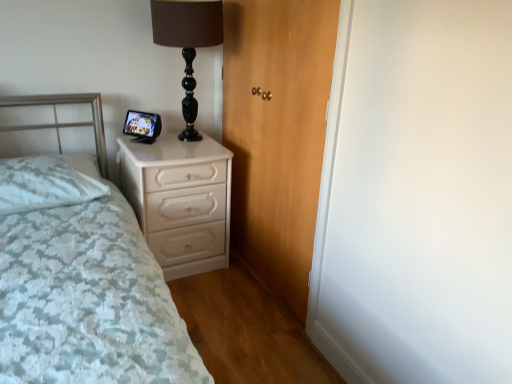
This screenshot has height=384, width=512. What do you see at coordinates (188, 43) in the screenshot?
I see `black glass table lamp at upper center` at bounding box center [188, 43].

What is the approximate height of white textured pillow at left?

white textured pillow at left is 6.54 inches tall.

Where is `white textured bed at left`? This screenshot has width=512, height=384. white textured bed at left is located at coordinates (81, 274).

Where is `white glossy chest of drawers at center`? This screenshot has height=384, width=512. white glossy chest of drawers at center is located at coordinates pyautogui.click(x=180, y=200).

The width and height of the screenshot is (512, 384). I want to click on black glass table lamp at upper center, so click(188, 43).

Is black glass table lamp at upper center next to wooden door at center?

There is a gap between black glass table lamp at upper center and wooden door at center.

Does black glass table lamp at upper center have a greater height compared to wooden door at center?

In fact, black glass table lamp at upper center may be shorter than wooden door at center.

Can you tell me how much white textured pillow at left and white textured bed at left differ in facing direction?

0.811 degrees separate the facing orientations of white textured pillow at left and white textured bed at left.

Considering the relative positions of white textured pillow at left and white textured bed at left in the image provided, is white textured pillow at left to the left or to the right of white textured bed at left?

Clearly, white textured pillow at left is on the left of white textured bed at left in the image.

You are a GUI agent. You are given a task and a screenshot of the screen. Output one action in this format:
    pyautogui.click(x=<x>, y=<y>)
    Task: Click on the pillow behind the white textured bed at left
    The image size is (512, 384).
    Given the screenshot: What is the action you would take?
    pyautogui.click(x=49, y=182)

Considering their positions, is white textured pillow at left located in front of or behind white textured bed at left?

white textured pillow at left is positioned farther from the viewer than white textured bed at left.

Is white glossy chest of drawers at center not inside wooden door at center?

Indeed, white glossy chest of drawers at center is completely outside wooden door at center.

Considering the relative sizes of white glossy chest of drawers at center and wooden door at center in the image provided, is white glossy chest of drawers at center thinner than wooden door at center?

In fact, white glossy chest of drawers at center might be wider than wooden door at center.

Is white glossy chest of drawers at center looking in the opposite direction of wooden door at center?

white glossy chest of drawers at center does not have its back to wooden door at center.

Which is more to the right, white glossy chest of drawers at center or wooden door at center?

wooden door at center.

Is white textured bed at left situated inside white textured pillow at left or outside?

white textured bed at left is spatially situated outside white textured pillow at left.

Between white textured bed at left and white textured pillow at left, which one appears on the left side from the viewer's perspective?

white textured pillow at left is more to the left.

Can you tell me how much white textured bed at left and white textured pillow at left differ in facing direction?

The angular difference between white textured bed at left and white textured pillow at left is 0.811 degrees.

Relative to white textured pillow at left, is white textured bed at left in front or behind?

Visually, white textured bed at left is located in front of white textured pillow at left.

Would you say white textured pillow at left contains white glossy chest of drawers at center?

No, white glossy chest of drawers at center is not inside white textured pillow at left.

Would you say white textured pillow at left is a long distance from white glossy chest of drawers at center?

No, there isn't a large distance between white textured pillow at left and white glossy chest of drawers at center.

Is point (38, 203) closer or farther from the camera than point (226, 243)?

Point (38, 203) is closer to the camera than point (226, 243).

The height and width of the screenshot is (384, 512). Identify the location of table lamp behind the white textured pillow at left. (188, 43).

From a real-world perspective, is white textured pillow at left on black glass table lamp at upper center?

No, from a real-world perspective, white textured pillow at left is not over black glass table lamp at upper center

How different are the orientations of white textured pillow at left and black glass table lamp at upper center in degrees?

The facing directions of white textured pillow at left and black glass table lamp at upper center are 1.24 degrees apart.

From the image's perspective, does white textured pillow at left appear higher than black glass table lamp at upper center?

No, from the image's perspective, white textured pillow at left is not above black glass table lamp at upper center.

Is black glass table lamp at upper center inside white glossy chest of drawers at center?

No, black glass table lamp at upper center is not surrounded by white glossy chest of drawers at center.

Consider the image. Between white glossy chest of drawers at center and black glass table lamp at upper center, which one has smaller width?

With smaller width is black glass table lamp at upper center.

Is white glossy chest of drawers at center aimed at black glass table lamp at upper center?

No.

You are a GUI agent. You are given a task and a screenshot of the screen. Output one action in this format:
    pyautogui.click(x=<x>, y=<y>)
    Task: Click on the door below the black glass table lamp at upper center (from the image's perspective)
    Image resolution: width=512 pixels, height=384 pixels.
    Given the screenshot: What is the action you would take?
    pyautogui.click(x=277, y=132)

At what (x,y) coordinates should I click in order to perform the action: click on pillow above the white textured bed at left (from the image's perspective). Please return your answer as a coordinate pair (x, y). Image resolution: width=512 pixels, height=384 pixels. Looking at the image, I should click on (49, 182).

Estimate the real-world distances between objects in this image. Which object is closer to white glossy chest of drawers at center, white textured bed at left or black glass table lamp at upper center?

white textured bed at left is closer to white glossy chest of drawers at center.

Looking at the image, which one is located closer to wooden door at center, white textured bed at left or black glass table lamp at upper center?

black glass table lamp at upper center is positioned closer to the anchor wooden door at center.

Looking at the image, which one is located closer to black glass table lamp at upper center, white textured pillow at left or white textured bed at left?

The object closer to black glass table lamp at upper center is white textured pillow at left.

Which object lies nearer to the anchor point black glass table lamp at upper center, white textured pillow at left or white glossy chest of drawers at center?

white glossy chest of drawers at center lies closer to black glass table lamp at upper center than the other object.

Looking at this image, when comparing their distances from white textured bed at left, does black glass table lamp at upper center or white textured pillow at left seem closer?

white textured pillow at left is positioned closer to the anchor white textured bed at left.

When comparing their distances from white textured pillow at left, does white textured bed at left or black glass table lamp at upper center seem further?

black glass table lamp at upper center is positioned further to the anchor white textured pillow at left.

From the image, which object appears to be nearer to white glossy chest of drawers at center, white textured bed at left or white textured pillow at left?

Among the two, white textured pillow at left is located nearer to white glossy chest of drawers at center.

Based on their spatial positions, is black glass table lamp at upper center or wooden door at center further from white glossy chest of drawers at center?

black glass table lamp at upper center is positioned further to the anchor white glossy chest of drawers at center.

Where is `chest of drawers between white textured pillow at left and wooden door at center`? This screenshot has width=512, height=384. chest of drawers between white textured pillow at left and wooden door at center is located at coordinates (180, 200).

Locate an element on the screen. This screenshot has width=512, height=384. pillow between black glass table lamp at upper center and white glossy chest of drawers at center in the vertical direction is located at coordinates (49, 182).

Where is `door located between white textured bed at left and black glass table lamp at upper center in the depth direction`? door located between white textured bed at left and black glass table lamp at upper center in the depth direction is located at coordinates (277, 132).

Where is `pillow between white textured bed at left and white glossy chest of drawers at center from front to back`? This screenshot has width=512, height=384. pillow between white textured bed at left and white glossy chest of drawers at center from front to back is located at coordinates (49, 182).